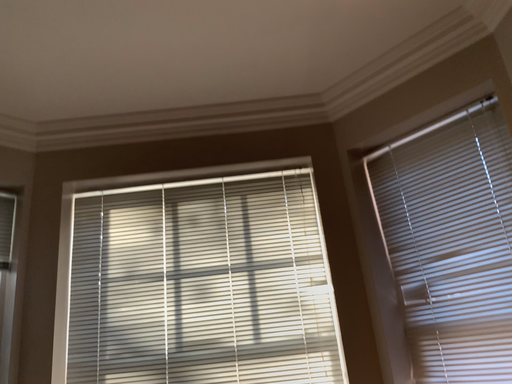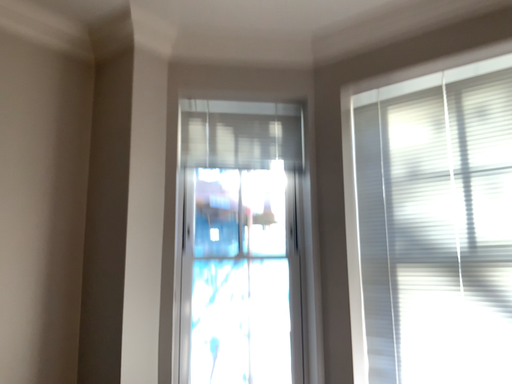
Question: How did the camera likely rotate when shooting the video?

Choices:
 (A) rotated right
 (B) rotated left

Answer: (B)